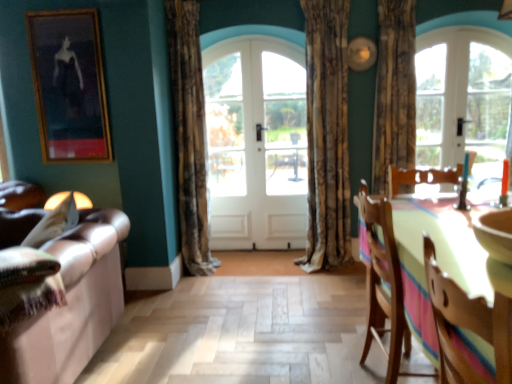
How much space does white glass door at center, arranged as the second screen door when viewed from the left, occupy horizontally?

The width of white glass door at center, arranged as the second screen door when viewed from the left, is 6.11 inches.

This screenshot has height=384, width=512. Describe the element at coordinates (285, 141) in the screenshot. I see `white glass door at center, acting as the first screen door starting from the right` at that location.

Where is `leather couch at left`? leather couch at left is located at coordinates (72, 304).

Where is `wooden chair at right, which is the 2th chair from front to back`? This screenshot has height=384, width=512. wooden chair at right, which is the 2th chair from front to back is located at coordinates (383, 285).

Identify the location of white wood door at right. This screenshot has width=512, height=384. [488, 110].

Identify the location of white glass door at center, arranged as the second screen door when viewed from the left. (285, 141).

Considering the sizes of wooden chair at lower right, placed as the 1th chair when sorted from front to back, and wooden chair at right, which is the 2th chair from front to back, in the image, is wooden chair at lower right, placed as the 1th chair when sorted from front to back, wider or thinner than wooden chair at right, which is the 2th chair from front to back,?

In the image, wooden chair at lower right, placed as the 1th chair when sorted from front to back, appears to be more narrow than wooden chair at right, which is the 2th chair from front to back.

Consider the image. Between wooden chair at lower right, placed as the 1th chair when sorted from front to back, and wooden chair at right, acting as the first chair starting from the back, which one appears on the left side from the viewer's perspective?

Positioned to the left is wooden chair at lower right, placed as the 1th chair when sorted from front to back.

Between wooden chair at lower right, which is the second chair from back to front, and wooden chair at right, acting as the first chair starting from the back, which one has larger size?

Bigger between the two is wooden chair at right, acting as the first chair starting from the back.

Is point (271, 75) in front of point (231, 144)?

Yes, point (271, 75) is in front of point (231, 144).

Considering the sizes of white glass door at center, acting as the first screen door starting from the right, and white glossy door at center, which is counted as the 1th screen door, starting from the left, in the image, is white glass door at center, acting as the first screen door starting from the right, bigger or smaller than white glossy door at center, which is counted as the 1th screen door, starting from the left,?

Considering their sizes, white glass door at center, acting as the first screen door starting from the right, takes up more space than white glossy door at center, which is counted as the 1th screen door, starting from the left.

Is white glass door at center, acting as the first screen door starting from the right, positioned with its back to white glossy door at center, the 2th screen door when ordered from right to left?

No, white glass door at center, acting as the first screen door starting from the right,'s orientation is not away from white glossy door at center, the 2th screen door when ordered from right to left.

Can you tell me how much white glass door at center, acting as the first screen door starting from the right, and white glossy door at center, which is counted as the 1th screen door, starting from the left, differ in facing direction?

white glass door at center, acting as the first screen door starting from the right, and white glossy door at center, which is counted as the 1th screen door, starting from the left, are facing 0.0248 degrees away from each other.

Is white wooden door at center to the left of white glossy door at center, which is counted as the 1th screen door, starting from the left, from the viewer's perspective?

No.

Are white wooden door at center and white glossy door at center, the 2th screen door when ordered from right to left, far apart?

No, white wooden door at center is in close proximity to white glossy door at center, the 2th screen door when ordered from right to left.

Is white wooden door at center outside of white glossy door at center, which is counted as the 1th screen door, starting from the left?

Actually, white wooden door at center is within white glossy door at center, which is counted as the 1th screen door, starting from the left.

Based on the photo, is white wooden door at center shorter than white glossy door at center, the 2th screen door when ordered from right to left?

In fact, white wooden door at center may be taller than white glossy door at center, the 2th screen door when ordered from right to left.

Consider the image. From the image's perspective, is textured beige curtain at center, marked as the second curtain in a right-to-left arrangement, beneath wooden framed painting at upper left?

Correct, textured beige curtain at center, marked as the second curtain in a right-to-left arrangement, appears lower than wooden framed painting at upper left in the image.

Could you tell me if textured beige curtain at center, marked as the second curtain in a right-to-left arrangement, is facing wooden framed painting at upper left?

No, textured beige curtain at center, marked as the second curtain in a right-to-left arrangement, is not oriented towards wooden framed painting at upper left.

Can you confirm if textured beige curtain at center, the 2th curtain viewed from the left, is wider than wooden framed painting at upper left?

Yes.

Does textured beige curtain at center, marked as the second curtain in a right-to-left arrangement, come behind wooden framed painting at upper left?

No, textured beige curtain at center, marked as the second curtain in a right-to-left arrangement, is in front of wooden framed painting at upper left.

Does leather couch at left have a greater width compared to wooden chair at lower right, which is the second chair from back to front?

Correct, the width of leather couch at left exceeds that of wooden chair at lower right, which is the second chair from back to front.

Is leather couch at left oriented towards wooden chair at lower right, placed as the 1th chair when sorted from front to back?

No.

Which is correct: leather couch at left is inside wooden chair at lower right, placed as the 1th chair when sorted from front to back, or outside of it?

leather couch at left is located beyond the bounds of wooden chair at lower right, placed as the 1th chair when sorted from front to back.

Does leather couch at left come in front of wooden chair at lower right, placed as the 1th chair when sorted from front to back?

No, it is behind wooden chair at lower right, placed as the 1th chair when sorted from front to back.

Between wooden chair at right, which is the 2th chair from front to back, and white wooden door at center, which one has smaller size?

white wooden door at center.

Is wooden chair at right, which is the 2th chair from front to back, turned away from white wooden door at center?

No, white wooden door at center is not at the back of wooden chair at right, which is the 2th chair from front to back.

From the picture: Is wooden chair at right, acting as the first chair starting from the back, completely or partially outside of white wooden door at center?

Yes, wooden chair at right, acting as the first chair starting from the back, is not within white wooden door at center.

Consider the image. How many degrees apart are the facing directions of wooden chair at right, which is the 2th chair from front to back, and white wooden door at center?

The angular difference between wooden chair at right, which is the 2th chair from front to back, and white wooden door at center is 91.7 degrees.

Considering the relative sizes of clear glass door at upper right and wooden framed painting at upper left in the image provided, is clear glass door at upper right bigger than wooden framed painting at upper left?

Yes.

Is clear glass door at upper right not near wooden framed painting at upper left?

Yes, clear glass door at upper right is far from wooden framed painting at upper left.

There is a clear glass door at upper right. Identify the location of picture frame above it (from a real-world perspective). (69, 85).

Is clear glass door at upper right looking in the opposite direction of wooden framed painting at upper left?

clear glass door at upper right does not have its back to wooden framed painting at upper left.

I want to click on chair that is above the wooden chair at right, which is the 2th chair from front to back (from the image's perspective), so click(x=466, y=325).

This screenshot has height=384, width=512. I want to click on screen door behind the white glass door at center, arranged as the second screen door when viewed from the left, so click(x=227, y=143).

From the image, which object appears to be farther from wooden chair at right, acting as the first chair starting from the back, white wooden door at center or white glossy door at center, which is counted as the 1th screen door, starting from the left?

Among the two, white glossy door at center, which is counted as the 1th screen door, starting from the left, is located further to wooden chair at right, acting as the first chair starting from the back.

Looking at the image, which one is located closer to leather couch at left, wooden framed painting at upper left or brown textured curtain at center, which is counted as the third curtain, starting from the left?

wooden framed painting at upper left is closer to leather couch at left.

Looking at the image, which one is located further to wooden chair at lower right, placed as the 1th chair when sorted from front to back, white wooden door at center or textured beige curtain at center, the 2th curtain viewed from the left?

white wooden door at center is further to wooden chair at lower right, placed as the 1th chair when sorted from front to back.

Estimate the real-world distances between objects in this image. Which object is closer to wooden chair at right, acting as the first chair starting from the back, white wood door at right or leather couch at left?

leather couch at left lies closer to wooden chair at right, acting as the first chair starting from the back, than the other object.

From the image, which object appears to be nearer to brown textured curtain at center, which is counted as the third curtain, starting from the left, textured beige curtain at center, the 2th curtain viewed from the left, or white wood door at right?

Among the two, textured beige curtain at center, the 2th curtain viewed from the left, is located nearer to brown textured curtain at center, which is counted as the third curtain, starting from the left.

Based on their spatial positions, is brown textured curtain at center, acting as the third curtain starting from the right, or white glossy door at center, which is counted as the 1th screen door, starting from the left, closer to brown textured curtain at center, which is counted as the third curtain, starting from the left?

white glossy door at center, which is counted as the 1th screen door, starting from the left, is positioned closer to the anchor brown textured curtain at center, which is counted as the third curtain, starting from the left.

Considering their positions, is white wood door at right positioned closer to textured beige curtain at center, the 2th curtain viewed from the left, than wooden chair at lower right, which is the second chair from back to front?

white wood door at right lies closer to textured beige curtain at center, the 2th curtain viewed from the left, than the other object.

Considering their positions, is white glossy door at center, which is counted as the 1th screen door, starting from the left, positioned further to brown textured curtain at center, the first curtain in the left-to-right sequence, than clear glass door at upper right?

The object further to brown textured curtain at center, the first curtain in the left-to-right sequence, is clear glass door at upper right.

This screenshot has height=384, width=512. I want to click on door between brown textured curtain at center, acting as the third curtain starting from the right, and brown textured curtain at center, which is counted as the third curtain, starting from the left, so click(x=256, y=144).

Locate an element on the screen. picture frame between leather couch at left and white wooden door at center in the front-back direction is located at coordinates (69, 85).

Where is `chair between wooden chair at lower right, placed as the 1th chair when sorted from front to back, and brown textured curtain at center, acting as the third curtain starting from the right, from front to back`? The width and height of the screenshot is (512, 384). chair between wooden chair at lower right, placed as the 1th chair when sorted from front to back, and brown textured curtain at center, acting as the third curtain starting from the right, from front to back is located at coordinates (383, 285).

Where is `window positioned between wooden chair at right, acting as the first chair starting from the back, and white wooden door at center from near to far`? window positioned between wooden chair at right, acting as the first chair starting from the back, and white wooden door at center from near to far is located at coordinates (463, 98).